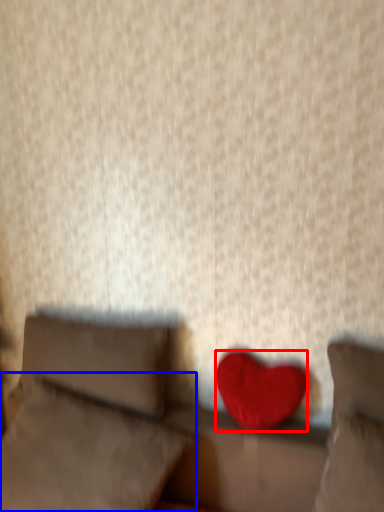
Question: Which object appears farthest to the camera in this image, heart (highlighted by a red box) or pillow (highlighted by a blue box)?

Choices:
 (A) heart
 (B) pillow

Answer: (A)